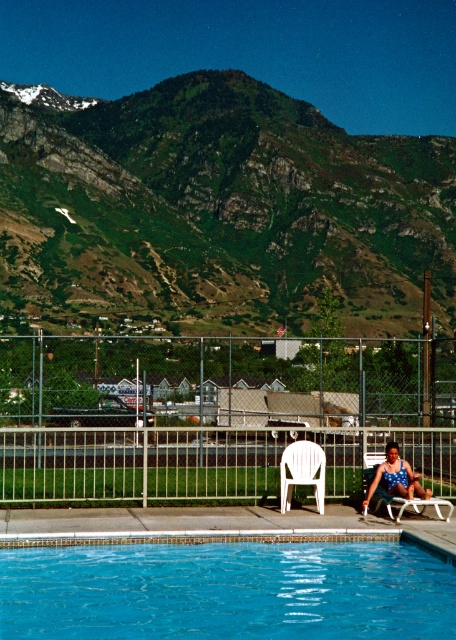
Does white plastic fence at center have a greater height compared to white plastic fence at lower center?

Yes.

Is white plastic fence at center smaller than white plastic fence at lower center?

No, white plastic fence at center is not smaller than white plastic fence at lower center.

Image resolution: width=456 pixels, height=640 pixels. Describe the element at coordinates (205, 422) in the screenshot. I see `white plastic fence at center` at that location.

Where is `white plastic fence at center`? The width and height of the screenshot is (456, 640). white plastic fence at center is located at coordinates (205, 422).

Looking at this image, is blue glossy water at center closer to camera compared to white plastic chair at center?

Yes, blue glossy water at center is closer to the viewer.

Who is positioned more to the right, blue glossy water at center or white plastic chair at center?

From the viewer's perspective, white plastic chair at center appears more on the right side.

Who is more distant from viewer, (x=108, y=582) or (x=322, y=480)?

Positioned behind is point (x=322, y=480).

At what (x,y) coordinates should I click in order to perform the action: click on blue glossy water at center. Please return your answer as a coordinate pair (x, y). Looking at the image, I should click on (227, 592).

Can you confirm if blue glossy water at center is positioned below white plastic fence at lower center?

Correct, blue glossy water at center is located below white plastic fence at lower center.

Between blue glossy water at center and white plastic fence at lower center, which one appears on the left side from the viewer's perspective?

Positioned to the left is blue glossy water at center.

Image resolution: width=456 pixels, height=640 pixels. I want to click on blue glossy water at center, so click(227, 592).